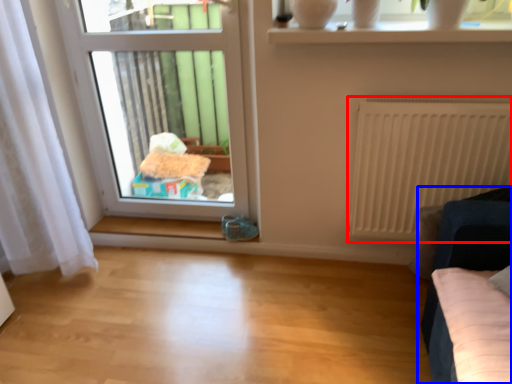
Question: Which point is closer to the camera, radiator (highlighted by a red box) or furniture (highlighted by a blue box)?

Choices:
 (A) radiator
 (B) furniture

Answer: (B)